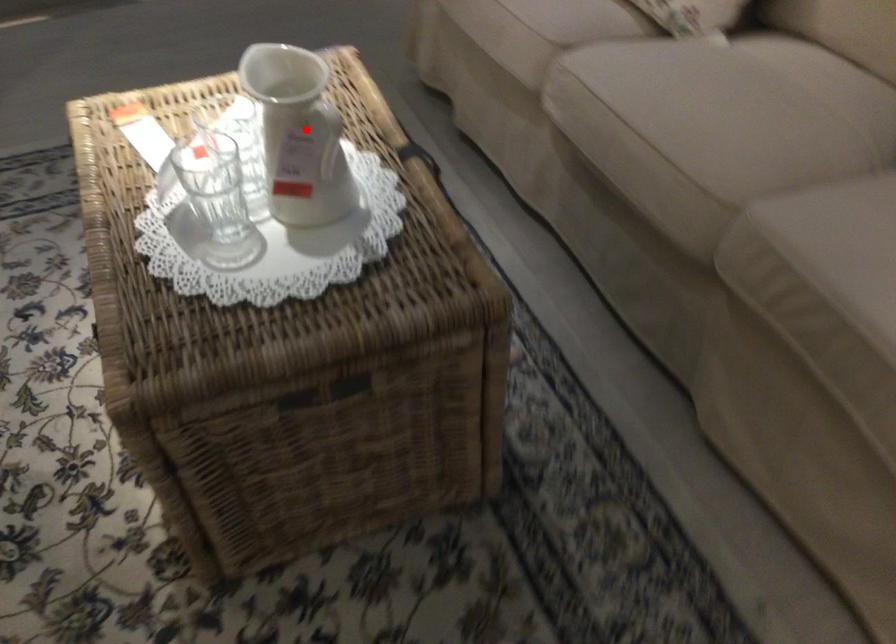
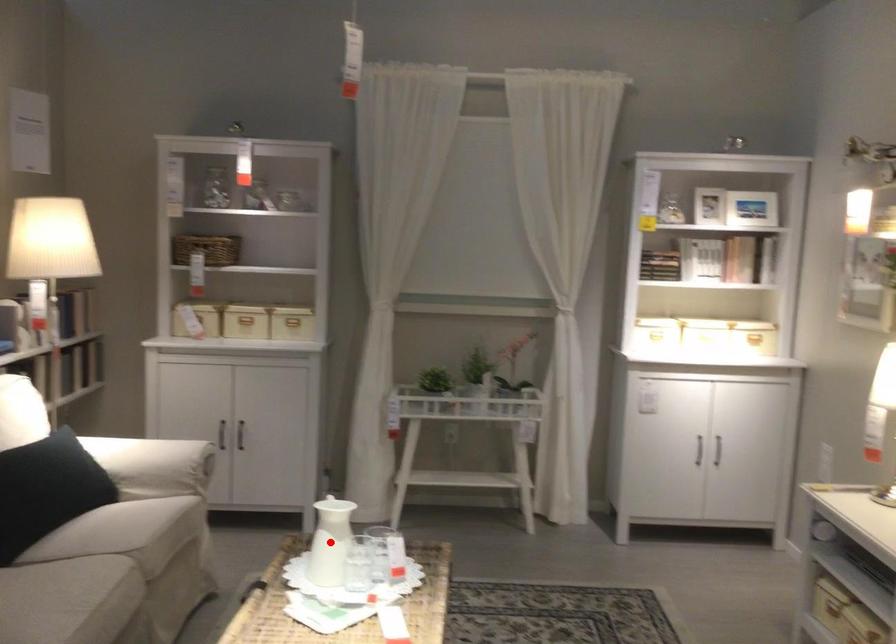
I am providing you with two images of the same scene from different viewpoints. A red point is marked on the first image and another point is marked on the second image. Is the marked point in image1 the same physical position as the marked point in image2?

Yes